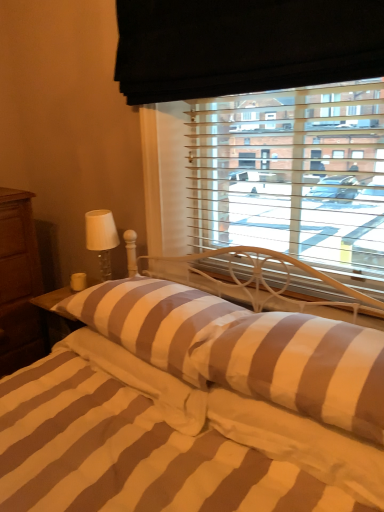
Question: Would you say white glass table lamp at left is to the left or to the right of striped fabric bed at center in the picture?

Choices:
 (A) right
 (B) left

Answer: (B)

Question: Considering their positions, is white glass table lamp at left located in front of or behind striped fabric bed at center?

Choices:
 (A) front
 (B) behind

Answer: (B)

Question: Estimate the real-world distances between objects in this image. Which object is farther from the brown striped pillow at center, positioned as the second pillow in left-to-right order?

Choices:
 (A) white glass table lamp at left
 (B) brown striped pillow at center, the 1th pillow in the left-to-right sequence
 (C) brown wood nightstand at left
 (D) striped fabric bed at center

Answer: (C)

Question: Estimate the real-world distances between objects in this image. Which object is farther from the brown striped pillow at center, positioned as the 1th pillow in right-to-left order?

Choices:
 (A) brown striped pillow at center, the 1th pillow in the left-to-right sequence
 (B) brown wood nightstand at left
 (C) white glass table lamp at left
 (D) striped fabric bed at center

Answer: (B)